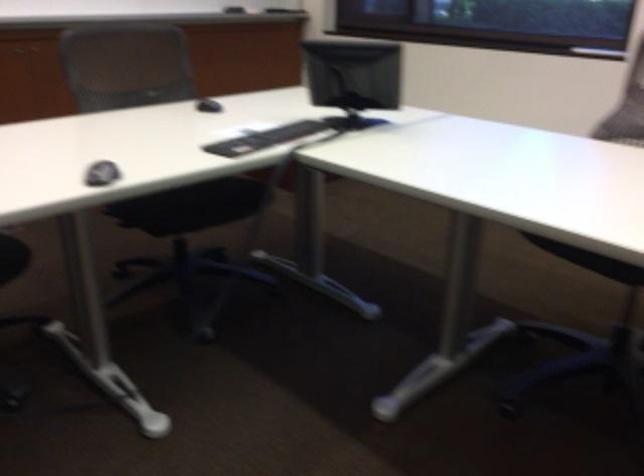
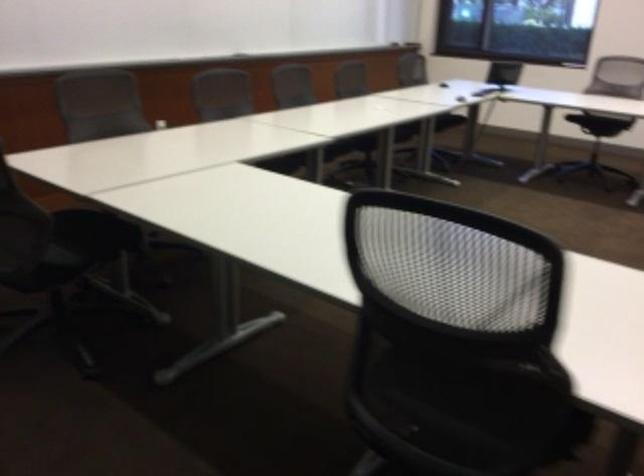
Looking at this image, which direction would the cameraman need to move to produce the second image?

The movement direction of the cameraman is left, backward.